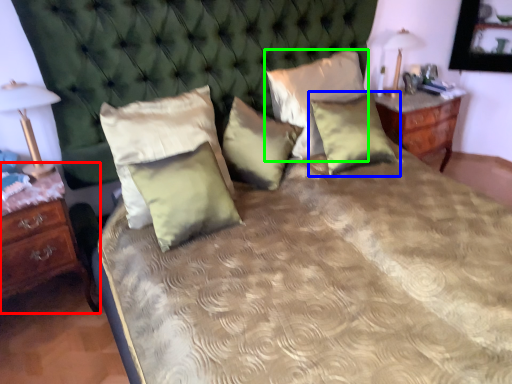
Question: Which object is the closest to the nightstand (highlighted by a red box)? Choose among these: pillow (highlighted by a blue box) or pillow (highlighted by a green box).

Choices:
 (A) pillow
 (B) pillow

Answer: (B)